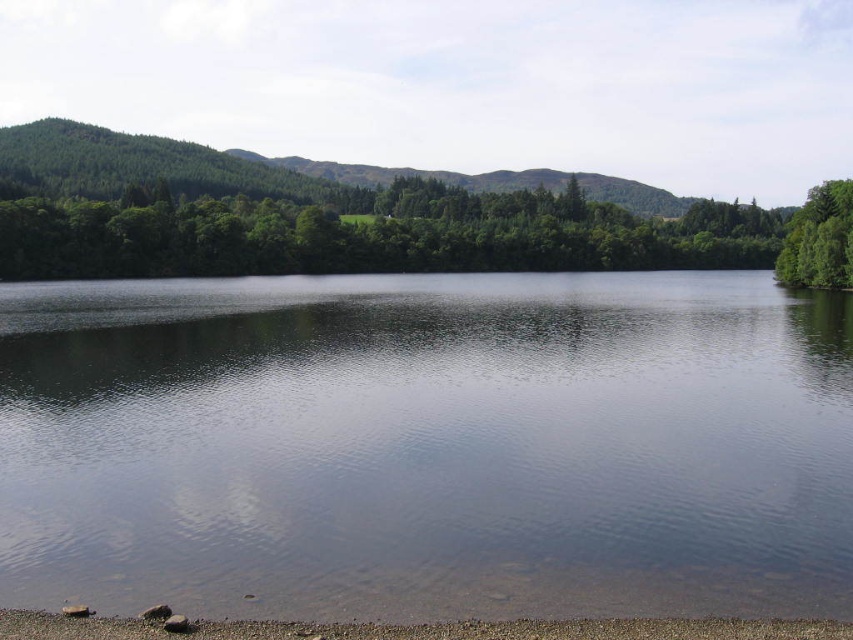
Consider the image. Which is below, smooth pebbles at lower center or green leafy tree at right?

Positioned lower is smooth pebbles at lower center.

I want to click on smooth pebbles at lower center, so click(x=415, y=628).

Can you confirm if clear water at center is thinner than green leafy tree at right?

No, clear water at center is not thinner than green leafy tree at right.

Does clear water at center have a lesser height compared to green leafy tree at right?

Yes, clear water at center is shorter than green leafy tree at right.

The width and height of the screenshot is (853, 640). I want to click on clear water at center, so click(x=427, y=445).

Who is positioned more to the right, clear water at center or green leafy tree at upper center?

Positioned to the right is green leafy tree at upper center.

Is clear water at center to the left of green leafy tree at upper center from the viewer's perspective?

Indeed, clear water at center is positioned on the left side of green leafy tree at upper center.

Who is more distant from viewer, (492, 449) or (57, 252)?

Point (57, 252)

I want to click on clear water at center, so 427,445.